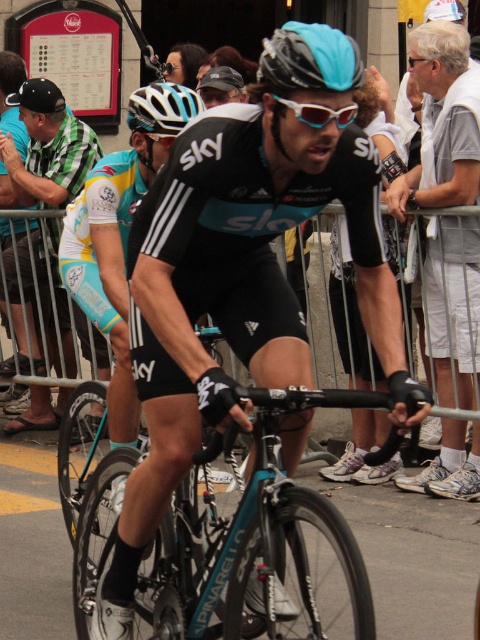
Who is more distant from viewer, (x=260, y=508) or (x=62, y=164)?

Point (x=62, y=164)

Is teal glossy bicycle at center behind light blue jersey at left?

No, teal glossy bicycle at center is closer to the viewer.

Is point (182, 483) more distant than point (95, 138)?

No.

Where is `teal glossy bicycle at center`? teal glossy bicycle at center is located at coordinates (251, 534).

Between light brown hair at upper center and white translucent goggles at center, which one has less height?

white translucent goggles at center is shorter.

Is light brown hair at upper center below white translucent goggles at center?

Incorrect, light brown hair at upper center is not positioned below white translucent goggles at center.

At what (x,y) coordinates should I click in order to perform the action: click on light brown hair at upper center. Please return your answer as a coordinate pair (x, y). This screenshot has width=480, height=640. Looking at the image, I should click on [x=183, y=64].

Is teal matte helmet at upper center positioned at the back of white translucent goggles at center?

That is False.

Which is behind, point (292, 44) or point (300, 109)?

The point (300, 109) is more distant.

From the picture: Measure the distance between point (285,44) and camera.

Point (285,44) and camera are 2.54 meters apart.

Locate an element on the screen. Image resolution: width=480 pixels, height=640 pixels. teal matte helmet at upper center is located at coordinates (310, 60).